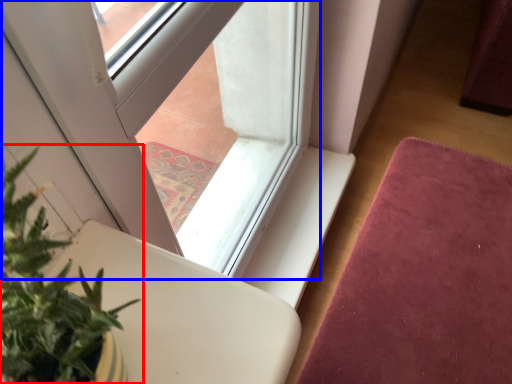
Question: Among these objects, which one is farthest to the camera, houseplant (highlighted by a red box) or window (highlighted by a blue box)?

Choices:
 (A) houseplant
 (B) window

Answer: (B)